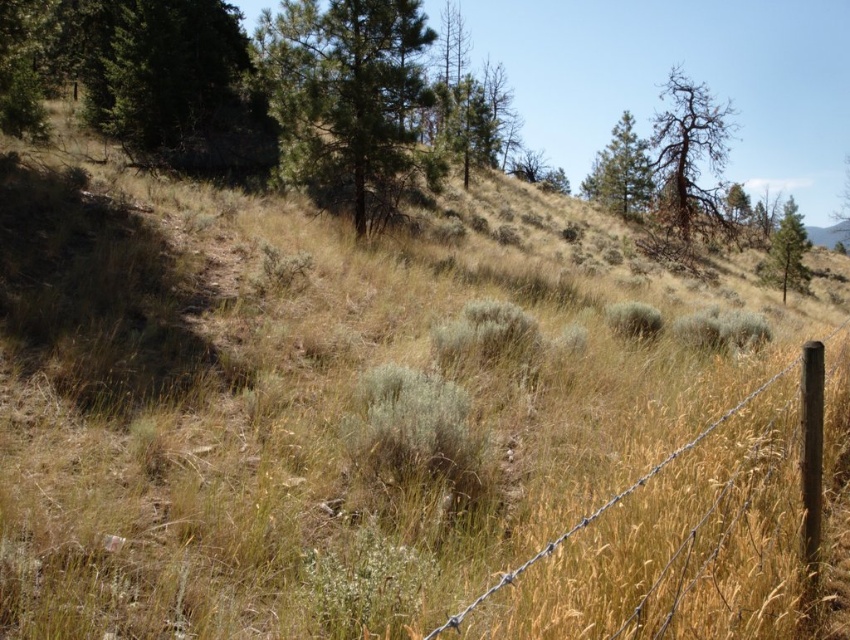
Is point (677, 92) farther from viewer compared to point (788, 225)?

No, (677, 92) is in front of (788, 225).

Based on the photo, who is more distant from viewer, (650,122) or (790,214)?

The point (650,122) is more distant.

In the scene shown: Measure the distance between point (684, 176) and camera.

Point (684, 176) is 32.29 meters away from camera.

At what (x,y) coordinates should I click in order to perform the action: click on brown textured tree at upper right. Please return your answer as a coordinate pair (x, y). Image resolution: width=850 pixels, height=640 pixels. Looking at the image, I should click on (686, 166).

Which of these two, green textured pine tree at upper center or brown textured tree at upper right, stands taller?

brown textured tree at upper right is taller.

Between green textured pine tree at upper center and brown textured tree at upper right, which one is positioned higher?

brown textured tree at upper right is higher up.

Between point (395, 97) and point (653, 129), which one is positioned in front?

Positioned in front is point (395, 97).

Identify the location of green textured pine tree at upper center. Image resolution: width=850 pixels, height=640 pixels. (346, 96).

Between brown textured tree at upper right and brown wire fence at lower right, which one is positioned higher?

brown textured tree at upper right is higher up.

Is point (647, 244) positioned behind point (656, 465)?

Yes, it is behind point (656, 465).

Who is more distant from viewer, (663, 241) or (462, 621)?

The point (663, 241) is more distant.

At what (x,y) coordinates should I click in order to perform the action: click on brown textured tree at upper right. Please return your answer as a coordinate pair (x, y). The width and height of the screenshot is (850, 640). Looking at the image, I should click on (686, 166).